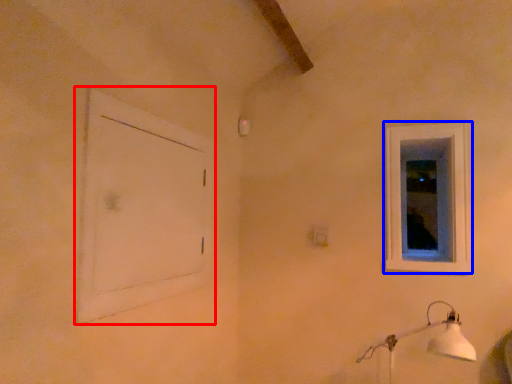
Question: Which of the following is the farthest to the observer, window frame (highlighted by a red box) or window (highlighted by a blue box)?

Choices:
 (A) window frame
 (B) window

Answer: (B)